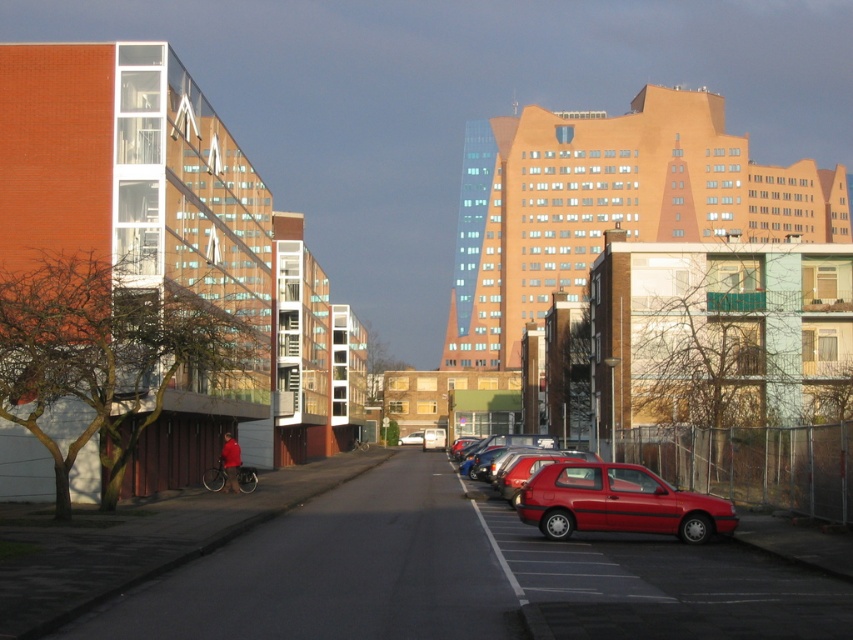
You are a pedestrian standing at the crosswalk in the middle of the street. You need to cross to the parking lot on the right. Which car, the shiny red hatchback at lower right or the matte red car at center, will you pass closer to as you walk towards the parking lot?

The shiny red hatchback at lower right is closer to the viewer than the matte red car at center, so you will pass closer to the shiny red hatchback at lower right as you walk towards the parking lot.

You are a delivery driver who needs to park your shiny red hatchback at lower right as close as possible to the matte red car at center. According to the scene, what is the minimum distance you can achieve between the two cars?

The minimum distance you can achieve between the shiny red hatchback at lower right and the matte red car at center is 114.43 meters.

You are a delivery person who needs to park your shiny red hatchback at lower right in a spot that can only accommodate vehicles smaller than the matte red car at center. Based on the scene, can your vehicle fit in the parking spot?

The shiny red hatchback at lower right is smaller than the matte red car at center, so it can fit in the parking spot designed for vehicles smaller than the matte red car at center.